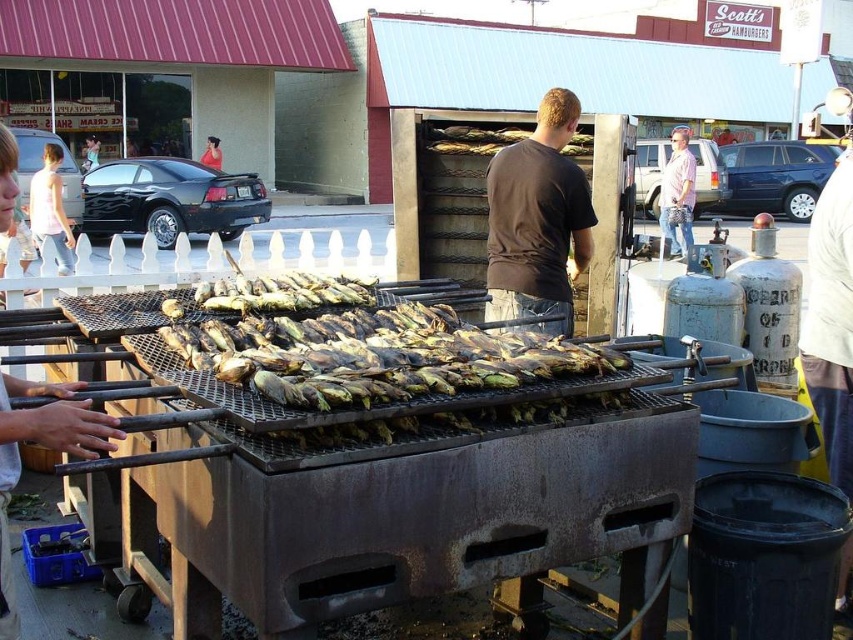
You are organizing a barbecue and need to place two shirts on a rack. The dark brown shirt at center and the pink cotton shirt at center must be arranged based on their positions in the image. Which shirt should you place on the left side of the rack?

The dark brown shirt at center should be placed on the left side of the rack because it is to the left of the pink cotton shirt at center in the image.

You are standing in front of a grill and see the charred corn at center and the pink cotton shirt at center. Which object is nearer to you?

The charred corn at center is closer to the viewer than the pink cotton shirt at center.

You are a food safety inspector and need to check the temperature of the corn on the grill. The grill has a temperature sensor at point (357,349). Where should you place the sensor to measure the temperature of the charred corn at center?

The charred corn at center is located at point (357,349), so you should place the sensor at that point to measure its temperature.